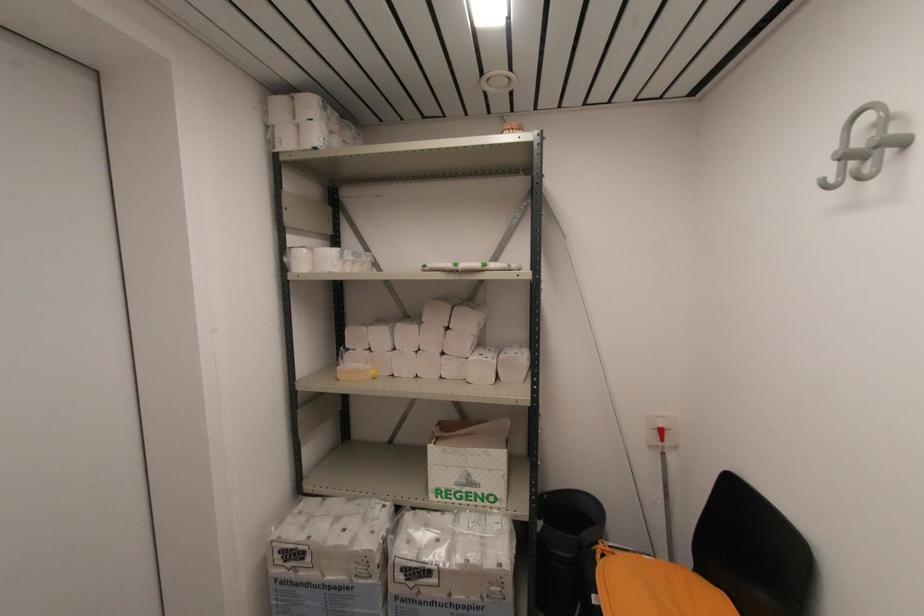
What do you see at coordinates (329, 559) in the screenshot? Image resolution: width=924 pixels, height=616 pixels. I see `a paper towel package` at bounding box center [329, 559].